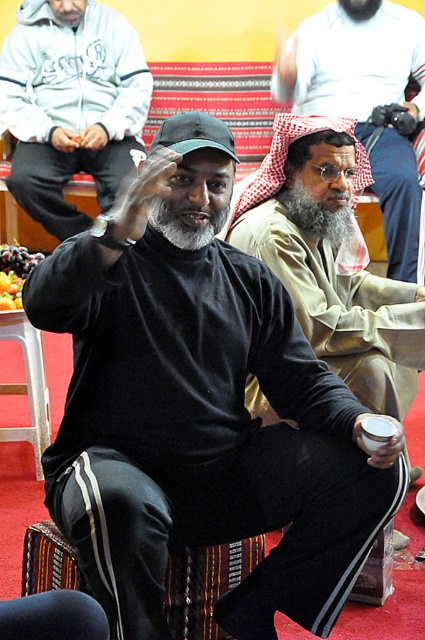
Question: Which point is closer to the camera taking this photo?

Choices:
 (A) (316, 349)
 (B) (45, 97)
 (C) (393, 262)

Answer: (A)

Question: Is matte black sweater at center bigger than black matte turtleneck at center?

Choices:
 (A) no
 (B) yes

Answer: (A)

Question: Does matte black sweater at center appear on the left side of black matte turtleneck at center?

Choices:
 (A) yes
 (B) no

Answer: (B)

Question: Which of the following is the closest to the observer?

Choices:
 (A) black matte turtleneck at center
 (B) matte black sweater at center

Answer: (B)

Question: Which object appears farthest from the camera in this image?

Choices:
 (A) black matte turtleneck at center
 (B) beige textured robe at center
 (C) matte black sweater at center

Answer: (A)

Question: Is matte black sweater at center to the right of beige textured robe at center from the viewer's perspective?

Choices:
 (A) yes
 (B) no

Answer: (B)